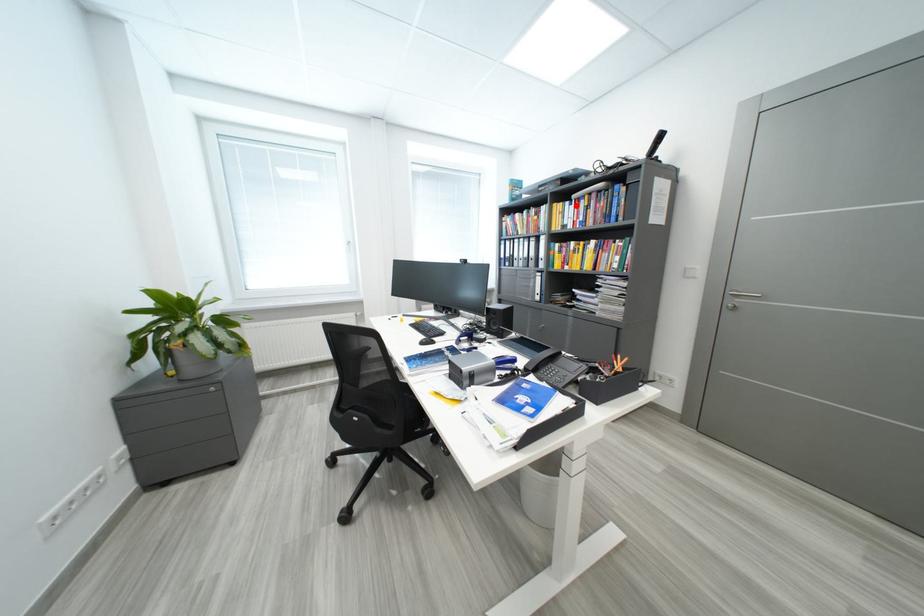
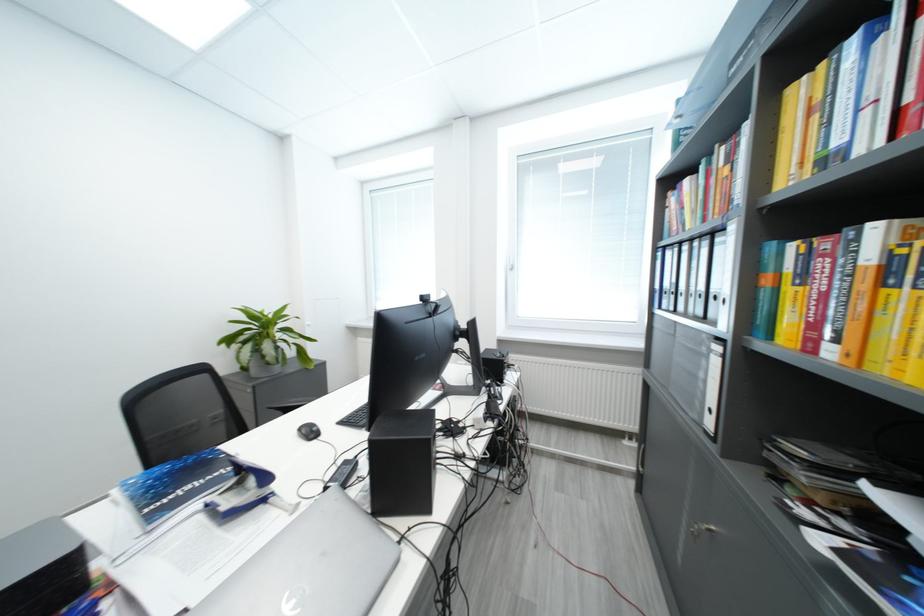
Find the pixel in the second image that matches the highlighted location in the first image.

(861, 44)